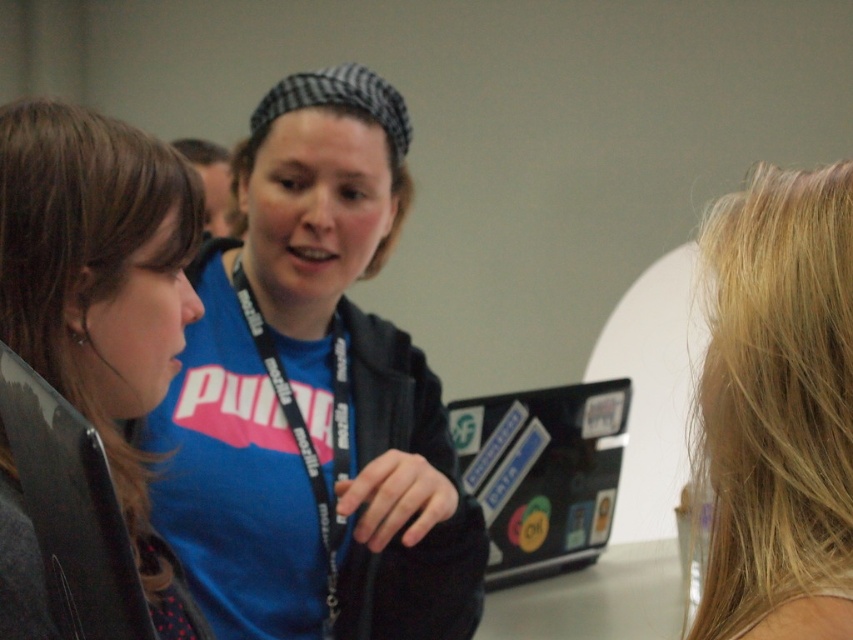
Question: Is matte blue shirt at center thinner than black glossy laptop at left?

Choices:
 (A) no
 (B) yes

Answer: (A)

Question: Among these objects, which one is farthest from the camera?

Choices:
 (A) matte blue shirt at center
 (B) black fabric lanyard at center

Answer: (B)

Question: Which point is farther to the camera?

Choices:
 (A) (114, 584)
 (B) (608, 499)
 (C) (364, 362)
 (D) (335, 566)

Answer: (B)

Question: Does black matte laptop at center have a smaller size compared to black fabric lanyard at center?

Choices:
 (A) no
 (B) yes

Answer: (A)

Question: Which point is closer to the camera taking this photo?

Choices:
 (A) (318, 497)
 (B) (730, 403)
 (C) (624, 406)

Answer: (B)

Question: Does blonde hair at right appear under black matte laptop at center?

Choices:
 (A) yes
 (B) no

Answer: (B)